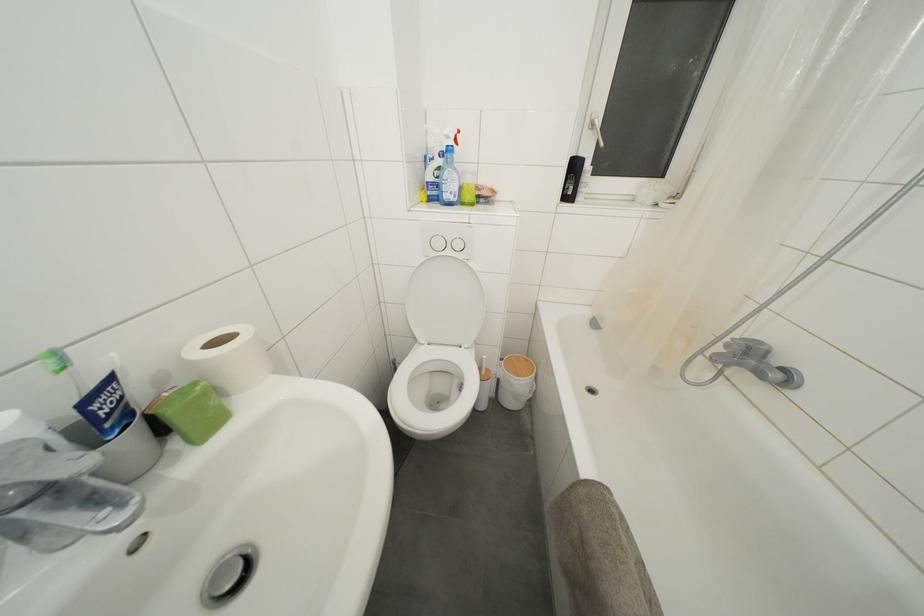
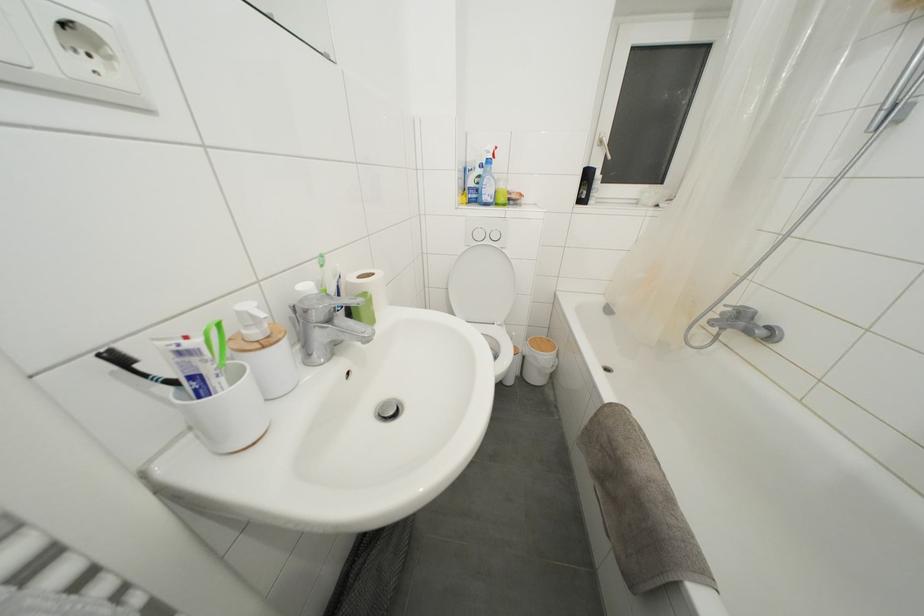
The point at (578, 172) is marked in the first image. Where is the corresponding point in the second image?

(591, 180)